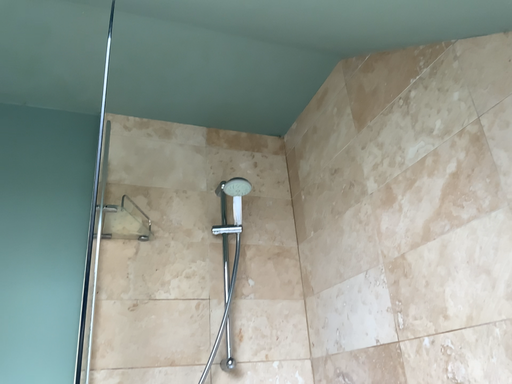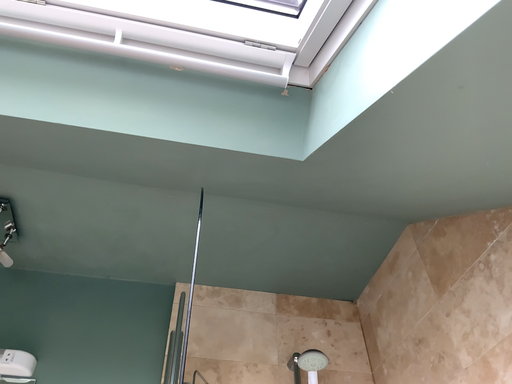
Question: How did the camera likely rotate when shooting the video?

Choices:
 (A) rotated upward
 (B) rotated downward

Answer: (A)